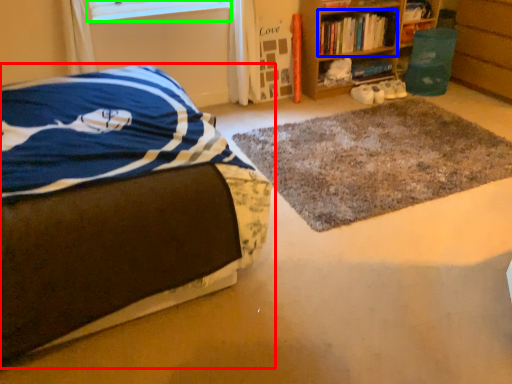
Question: Which object is positioned closest to bed (highlighted by a red box)? Select from book (highlighted by a blue box) and window screen (highlighted by a green box).

Choices:
 (A) book
 (B) window screen

Answer: (B)